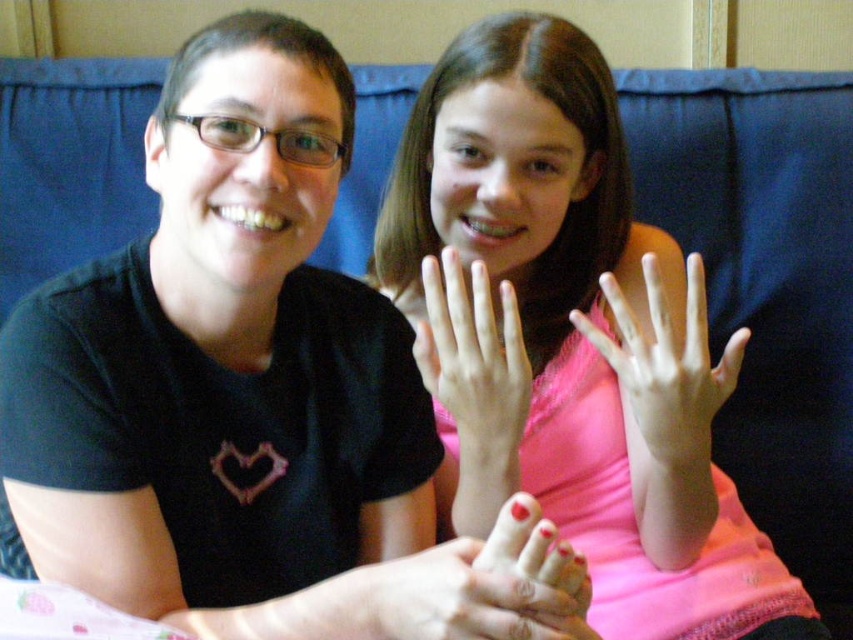
Can you confirm if smooth painted nail at center is bigger than pink matte hand at center?

Incorrect, smooth painted nail at center is not larger than pink matte hand at center.

Between point (508, 632) and point (622, 380), which one is positioned behind?

The point (622, 380) is behind.

I want to click on smooth painted nail at center, so click(479, 586).

The width and height of the screenshot is (853, 640). I want to click on pink matte nails at center, so click(x=572, y=339).

Between point (399, 289) and point (491, 360), which one is positioned behind?

The point (399, 289) is behind.

Measure the distance between point (664, 332) and camera.

A distance of 29.32 inches exists between point (664, 332) and camera.

Identify the location of pink matte nails at center. (572, 339).

Between point (729, 342) and point (495, 522), which one is positioned behind?

Positioned behind is point (495, 522).

Can you confirm if pink matte hand at center is smaller than smooth pink nail polish at lower center?

No, pink matte hand at center is not smaller than smooth pink nail polish at lower center.

Between point (645, 282) and point (560, 618), which one is positioned behind?

Positioned behind is point (645, 282).

Locate an element on the screen. The height and width of the screenshot is (640, 853). pink matte hand at center is located at coordinates (666, 365).